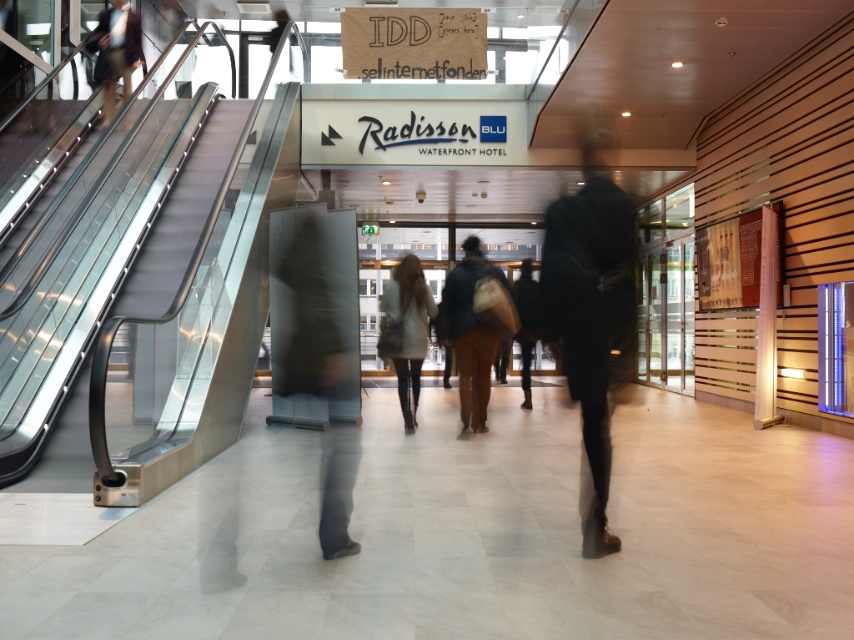
Question: Does metallic gray escalator at left appear under brown leather jacket at center?

Choices:
 (A) yes
 (B) no

Answer: (B)

Question: Does metallic gray escalator at left appear over brown leather jacket at center?

Choices:
 (A) yes
 (B) no

Answer: (A)

Question: Which object appears farthest from the camera in this image?

Choices:
 (A) metallic gray escalator at left
 (B) brown leather jacket at center
 (C) dark gray fabric coat at center

Answer: (A)

Question: Is brown leather jacket at center below dark brown leather jacket at center?

Choices:
 (A) yes
 (B) no

Answer: (B)

Question: Among these points, which one is farthest from the camera?

Choices:
 (A) (490, 269)
 (B) (114, 83)
 (C) (88, 483)

Answer: (B)

Question: Among these objects, which one is nearest to the camera?

Choices:
 (A) dark brown leather jacket at center
 (B) brown leather jacket at center

Answer: (B)